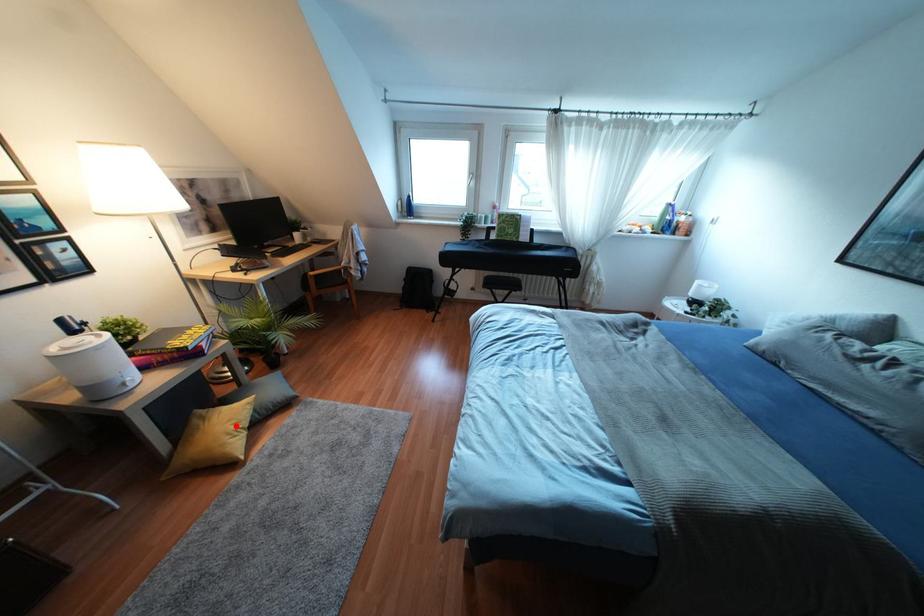
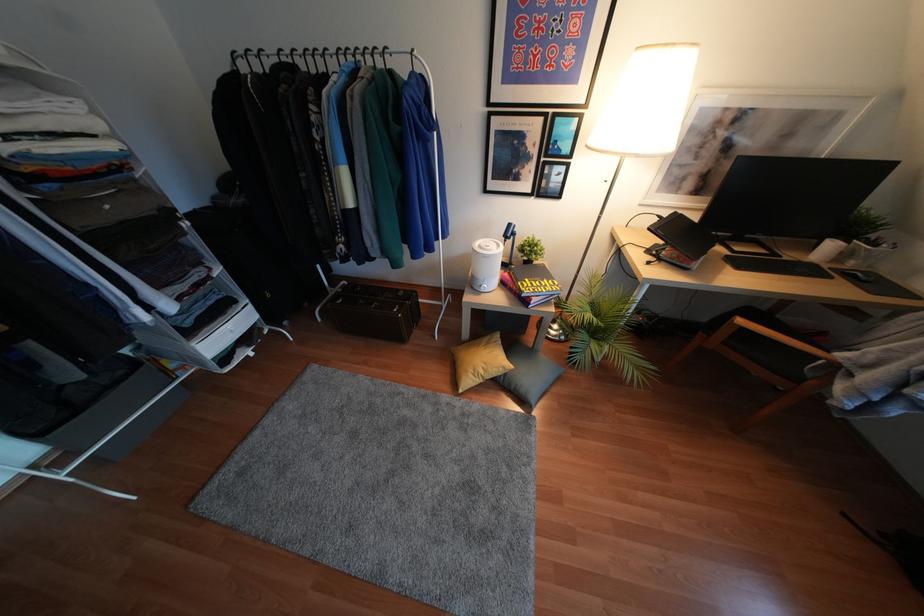
Locate, in the second image, the point that corresponds to the highlighted location in the first image.

(480, 371)